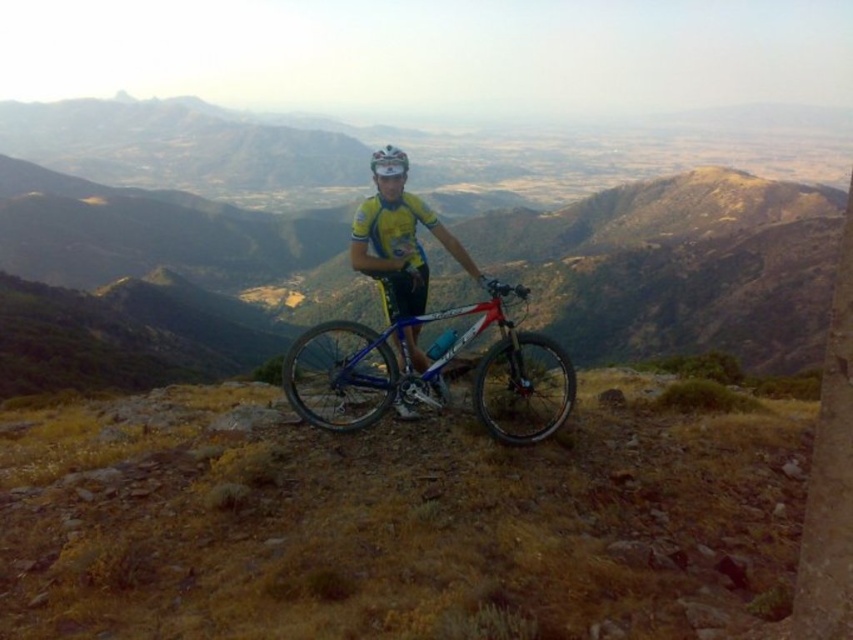
You are a cyclist who just arrived at the rocky, grassy hilltop overlooking a vast mountainous landscape. You see the blue metallic bicycle at center. Where exactly is the blue metallic bicycle located in the image?

The blue metallic bicycle at center is located at point coordinates of 0.584 on the x axis and 0.492 on the y axis.

You are a photographer planning to capture a wide landscape shot. You have a camera with a 35mm lens that can capture a horizontal field of view of 60 degrees. The blue metallic bicycle at center and the yellow jersey at center are both in your frame. Considering their sizes, which object would appear wider in the photograph?

The blue metallic bicycle at center would appear wider in the photograph because its width is larger than the yellow jersey at center according to the description.